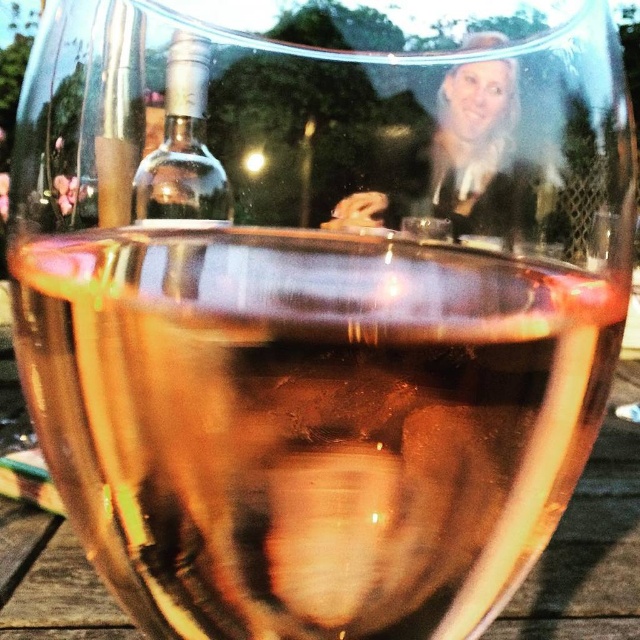
Does matte black hair at upper center have a larger size compared to clear glass bottle at upper center?

Indeed, matte black hair at upper center has a larger size compared to clear glass bottle at upper center.

Who is taller, matte black hair at upper center or clear glass bottle at upper center?

With more height is matte black hair at upper center.

Is point (449, 216) behind point (192, 172)?

Yes, point (449, 216) is behind point (192, 172).

Where is `matte black hair at upper center`? The image size is (640, 640). matte black hair at upper center is located at coordinates (460, 161).